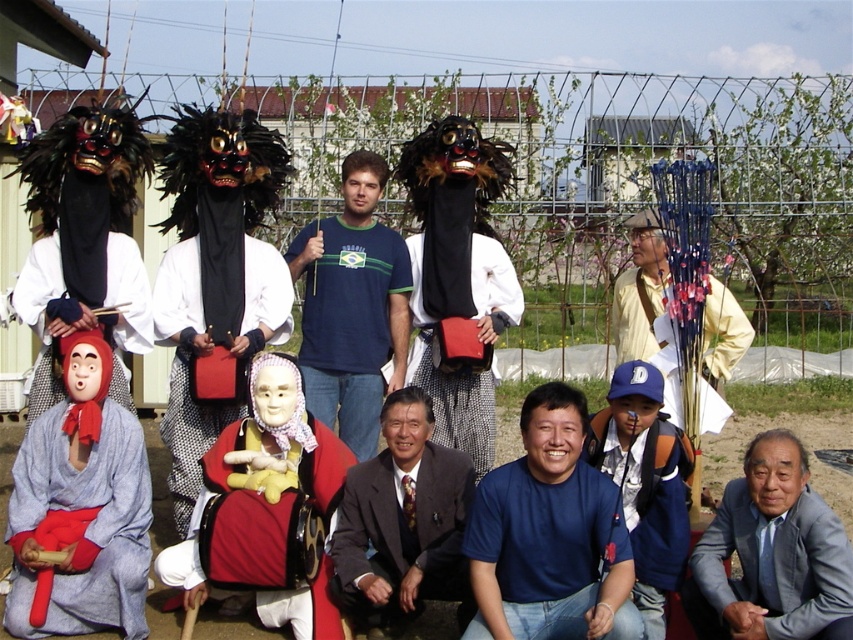
Who is shorter, blue cotton t-shirt at center or blue fabric mask at lower center?

blue fabric mask at lower center

How far apart are blue cotton t-shirt at center and blue fabric mask at lower center?

A distance of 7.07 feet exists between blue cotton t-shirt at center and blue fabric mask at lower center.

Is point (312, 275) more distant than point (666, 452)?

Yes, point (312, 275) is behind point (666, 452).

In order to click on blue cotton t-shirt at center in this screenshot , I will do `click(352, 307)`.

Does black matte bag at center appear on the right side of velvet red costume at center?

Correct, you'll find black matte bag at center to the right of velvet red costume at center.

Measure the distance between black matte bag at center and velvet red costume at center.

The distance of black matte bag at center from velvet red costume at center is 1.58 meters.

Locate an element on the screen. black matte bag at center is located at coordinates (450, 381).

The height and width of the screenshot is (640, 853). I want to click on black matte bag at center, so tap(450, 381).

Is blue cotton t-shirt at center bigger than velvet red costume at center?

Yes.

Between blue cotton t-shirt at center and velvet red costume at center, which one has more height?

blue cotton t-shirt at center is taller.

Where is `blue cotton t-shirt at center`? The width and height of the screenshot is (853, 640). blue cotton t-shirt at center is located at coordinates [352, 307].